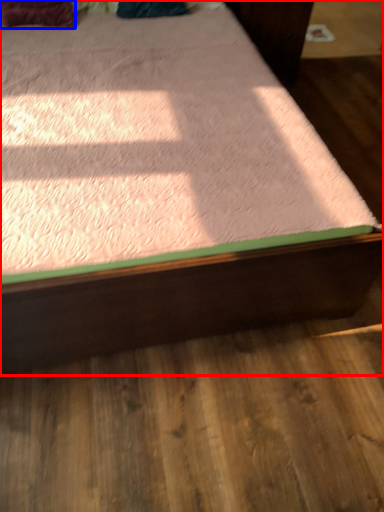
Question: Which of the following is the closest to the observer, bed (highlighted by a red box) or pillow (highlighted by a blue box)?

Choices:
 (A) bed
 (B) pillow

Answer: (A)